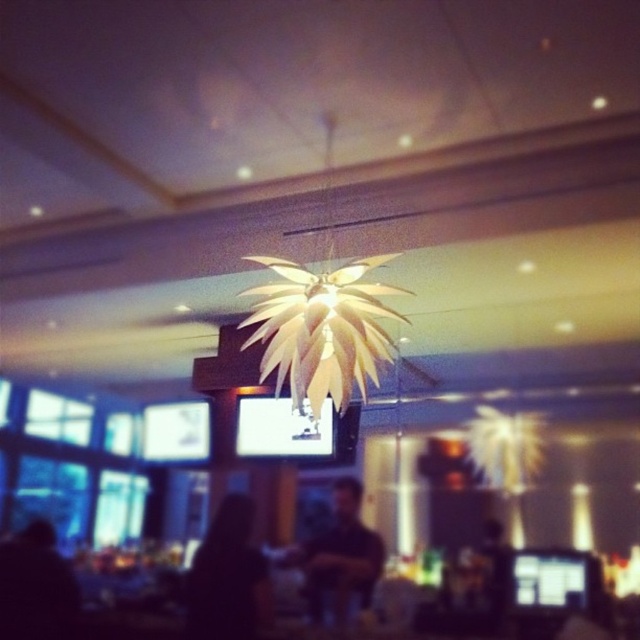
Question: Is black matte person at lower center above black matte shirt at center?

Choices:
 (A) no
 (B) yes

Answer: (A)

Question: Which of the following is the closest to the observer?

Choices:
 (A) (26, 580)
 (B) (337, 410)

Answer: (B)

Question: Where is matte gold leaf chandelier at center located in relation to black matte shirt at center in the image?

Choices:
 (A) left
 (B) right

Answer: (A)

Question: In this image, where is matte gold leaf chandelier at center located relative to black matte person at lower center?

Choices:
 (A) above
 (B) below

Answer: (A)

Question: Which object appears closest to the camera in this image?

Choices:
 (A) black matte person at lower center
 (B) black matte person at lower left
 (C) matte gold leaf chandelier at center

Answer: (C)

Question: Which object appears closest to the camera in this image?

Choices:
 (A) black matte person at lower left
 (B) black matte shirt at center

Answer: (B)